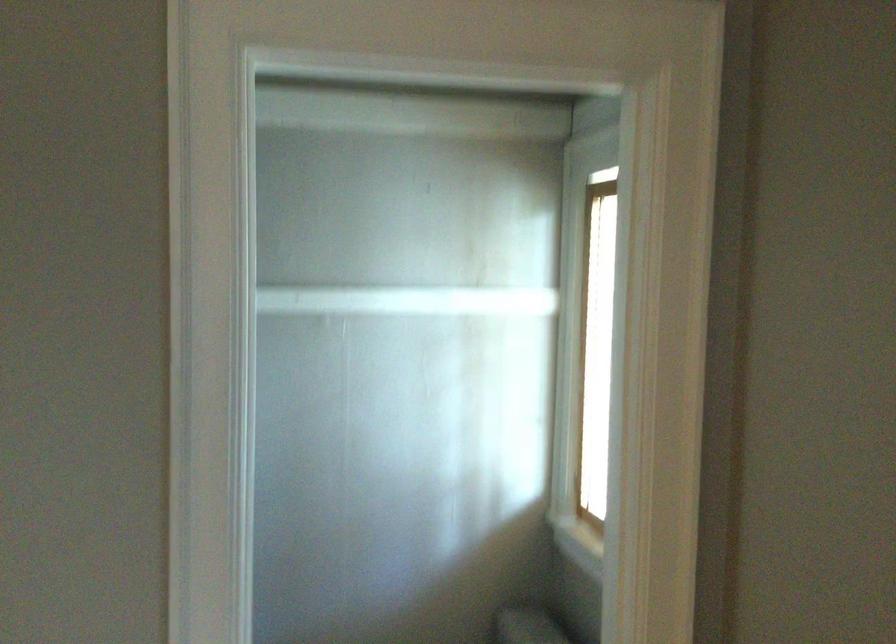
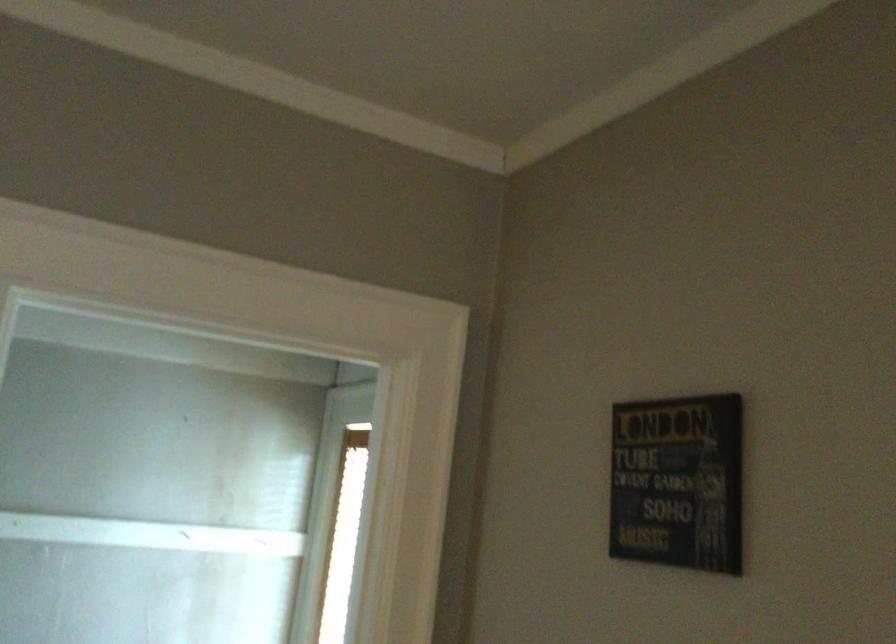
Question: What movement of the cameraman would produce the second image?

Choices:
 (A) Left
 (B) Right
 (C) Forward
 (D) Backward

Answer: (D)